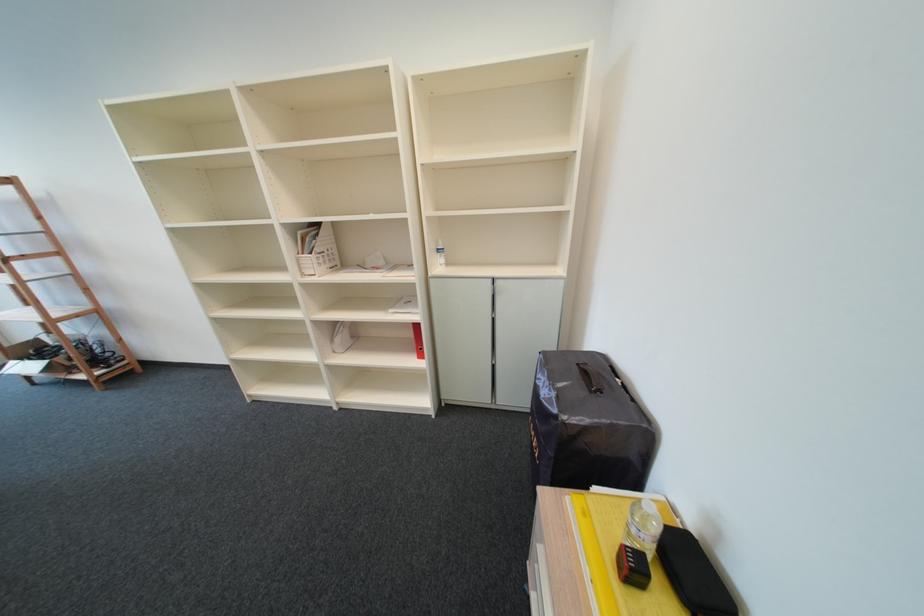
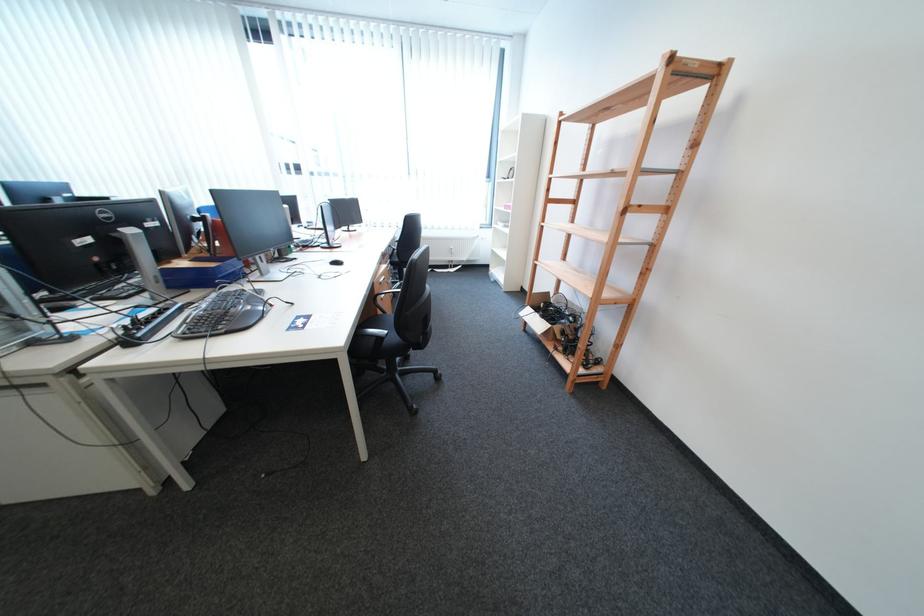
Where in the second image is the point corresponding to pixel 58 363 from the first image?

(562, 326)